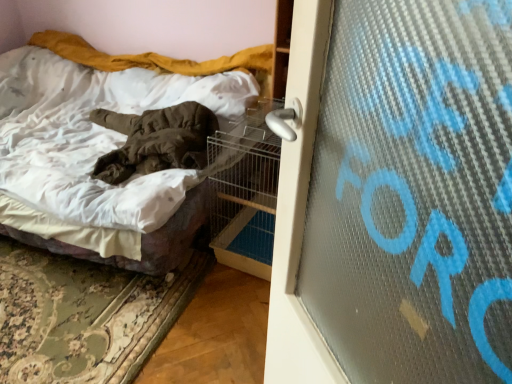
I want to click on metal wire birdcage at center, so click(245, 191).

This screenshot has width=512, height=384. Describe the element at coordinates (245, 191) in the screenshot. I see `metal wire birdcage at center` at that location.

Locate an element on the screen. The height and width of the screenshot is (384, 512). white cotton bed at center is located at coordinates (112, 149).

What is the approximate height of white cotton bed at center?

white cotton bed at center is 24.88 inches in height.

Measure the distance between white cotton bed at center and camera.

A distance of 1.53 meters exists between white cotton bed at center and camera.

Describe the element at coordinates (112, 149) in the screenshot. I see `white cotton bed at center` at that location.

This screenshot has height=384, width=512. I want to click on metal wire birdcage at center, so coord(245,191).

Which object is positioned more to the left, white cotton bed at center or metal wire birdcage at center?

white cotton bed at center is more to the left.

Which object is more forward, white cotton bed at center or metal wire birdcage at center?

white cotton bed at center is more forward.

Is point (118, 137) more distant than point (247, 240)?

Yes, point (118, 137) is behind point (247, 240).

From the image's perspective, is white cotton bed at center under metal wire birdcage at center?

Incorrect, from the image's perspective, white cotton bed at center is higher than metal wire birdcage at center.

From a real-world perspective, is white cotton bed at center over metal wire birdcage at center?

Yes, from a real-world perspective, white cotton bed at center is over metal wire birdcage at center

Which of these two, white cotton bed at center or metal wire birdcage at center, is wider?

white cotton bed at center.

Considering the relative sizes of white cotton bed at center and metal wire birdcage at center in the image provided, is white cotton bed at center shorter than metal wire birdcage at center?

Correct, white cotton bed at center is not as tall as metal wire birdcage at center.

Is white cotton bed at center bigger than metal wire birdcage at center?

Yes.

Is white cotton bed at center spatially inside metal wire birdcage at center, or outside of it?

white cotton bed at center lies outside metal wire birdcage at center.

Would you say white cotton bed at center is a long distance from metal wire birdcage at center?

That's not correct — white cotton bed at center is a little close to metal wire birdcage at center.

Does white cotton bed at center turn towards metal wire birdcage at center?

No, white cotton bed at center does not turn towards metal wire birdcage at center.

This screenshot has width=512, height=384. I want to click on bed positioned vertically above the metal wire birdcage at center (from a real-world perspective), so click(x=112, y=149).

From the picture: Can you confirm if metal wire birdcage at center is positioned to the right of white cotton bed at center?

Correct, you'll find metal wire birdcage at center to the right of white cotton bed at center.

Is metal wire birdcage at center closer to camera compared to white cotton bed at center?

No, the depth of metal wire birdcage at center is greater than that of white cotton bed at center.

Is point (265, 204) closer or farther from the camera than point (126, 207)?

Point (265, 204).

From the image's perspective, relative to white cotton bed at center, is metal wire birdcage at center above or below?

metal wire birdcage at center is below white cotton bed at center.

From a real-world perspective, relative to white cotton bed at center, is metal wire birdcage at center vertically above or below?

From a real-world perspective, metal wire birdcage at center is physically below white cotton bed at center.

Considering the sizes of objects metal wire birdcage at center and white cotton bed at center in the image provided, who is thinner, metal wire birdcage at center or white cotton bed at center?

metal wire birdcage at center.

Based on the photo, considering the sizes of objects metal wire birdcage at center and white cotton bed at center in the image provided, who is taller, metal wire birdcage at center or white cotton bed at center?

Standing taller between the two is metal wire birdcage at center.

Considering the relative sizes of metal wire birdcage at center and white cotton bed at center in the image provided, is metal wire birdcage at center bigger than white cotton bed at center?

Actually, metal wire birdcage at center might be smaller than white cotton bed at center.

Is metal wire birdcage at center inside or outside of white cotton bed at center?

metal wire birdcage at center is spatially situated outside white cotton bed at center.

Does metal wire birdcage at center touch white cotton bed at center?

No, metal wire birdcage at center is not with white cotton bed at center.

Could you tell me if metal wire birdcage at center is facing white cotton bed at center?

No.

Can you tell me how much metal wire birdcage at center and white cotton bed at center differ in facing direction?

The angle between the facing direction of metal wire birdcage at center and the facing direction of white cotton bed at center is 3.69 degrees.

Where is `bed in front of the metal wire birdcage at center`? This screenshot has height=384, width=512. bed in front of the metal wire birdcage at center is located at coordinates (112, 149).

You are a GUI agent. You are given a task and a screenshot of the screen. Output one action in this format:
    pyautogui.click(x=<x>, y=<y>)
    Task: Click on the bed positioned vertically above the metal wire birdcage at center (from a real-world perspective)
    
    Given the screenshot: What is the action you would take?
    pyautogui.click(x=112, y=149)

This screenshot has height=384, width=512. I want to click on bird cage on the right side of white cotton bed at center, so click(245, 191).